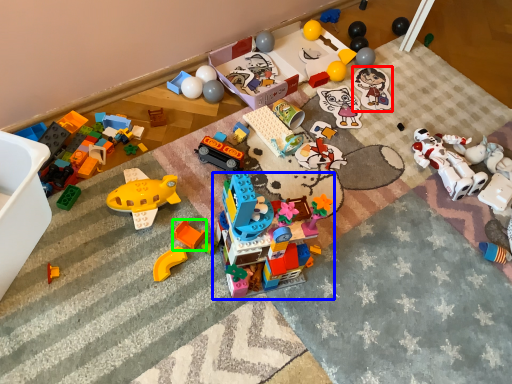
Question: Which object is the closest to the toy (highlighted by a red box)? Choose among these: toy (highlighted by a blue box) or toy (highlighted by a green box).

Choices:
 (A) toy
 (B) toy

Answer: (A)